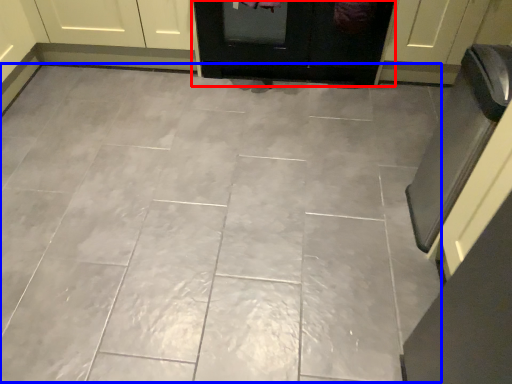
Question: Which point is closer to the camera, door (highlighted by a red box) or ceramic tile (highlighted by a blue box)?

Choices:
 (A) door
 (B) ceramic tile

Answer: (B)